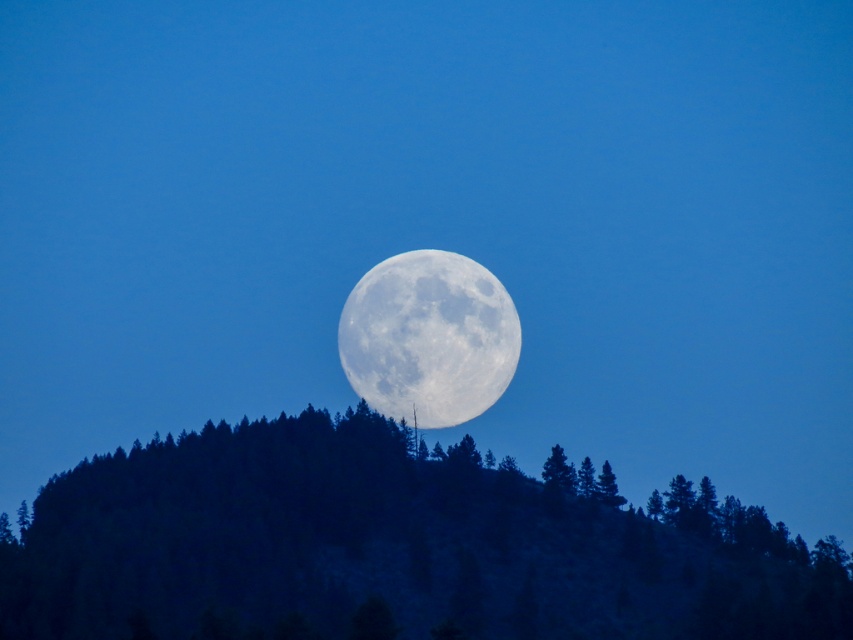
Question: Estimate the real-world distances between objects in this image. Which object is closer to the green matte tree at upper right?

Choices:
 (A) green matte tree at center
 (B) white textured moon at center
 (C) green textured tree at upper center

Answer: (A)

Question: Does green textured tree at upper center have a larger size compared to green matte tree at upper right?

Choices:
 (A) no
 (B) yes

Answer: (B)

Question: Observing the image, what is the correct spatial positioning of green textured tree at upper center in reference to green matte tree at upper right?

Choices:
 (A) left
 (B) right

Answer: (A)

Question: Estimate the real-world distances between objects in this image. Which object is closer to the white textured moon at center?

Choices:
 (A) green textured tree at upper center
 (B) green matte tree at upper right

Answer: (A)

Question: Which of the following is the closest to the observer?

Choices:
 (A) (355, 310)
 (B) (554, 481)

Answer: (B)

Question: Where is green textured tree at upper center located in relation to white textured moon at center in the image?

Choices:
 (A) above
 (B) below

Answer: (B)